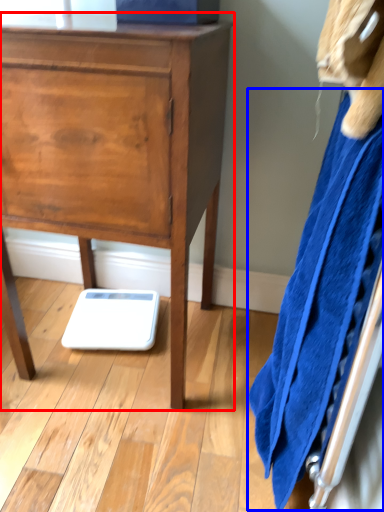
Question: Which object is further to the camera taking this photo, chest of drawers (highlighted by a red box) or bath towel (highlighted by a blue box)?

Choices:
 (A) chest of drawers
 (B) bath towel

Answer: (A)